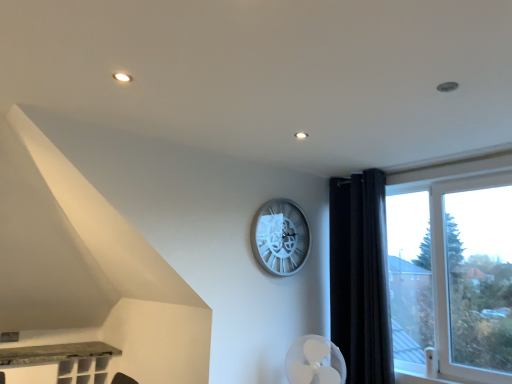
Question: From the image's perspective, would you say black velvet curtain at right is positioned over transparent glass window at right?

Choices:
 (A) no
 (B) yes

Answer: (A)

Question: From a real-world perspective, is black velvet curtain at right located beneath transparent glass window at right?

Choices:
 (A) yes
 (B) no

Answer: (A)

Question: Can you confirm if black velvet curtain at right is bigger than transparent glass window at right?

Choices:
 (A) no
 (B) yes

Answer: (B)

Question: Are black velvet curtain at right and transparent glass window at right located far from each other?

Choices:
 (A) no
 (B) yes

Answer: (A)

Question: Is black velvet curtain at right closer to camera compared to transparent glass window at right?

Choices:
 (A) no
 (B) yes

Answer: (A)

Question: Which is correct: black velvet curtain at right is inside transparent glass window at right, or outside of it?

Choices:
 (A) inside
 (B) outside

Answer: (B)

Question: In terms of width, does black velvet curtain at right look wider or thinner when compared to transparent glass window at right?

Choices:
 (A) thin
 (B) wide

Answer: (B)

Question: From the image's perspective, relative to transparent glass window at right, is black velvet curtain at right above or below?

Choices:
 (A) below
 (B) above

Answer: (A)

Question: From a real-world perspective, relative to transparent glass window at right, is black velvet curtain at right vertically above or below?

Choices:
 (A) below
 (B) above

Answer: (A)

Question: Considering the positions of silver metallic clock at center and black velvet curtain at right in the image, is silver metallic clock at center bigger or smaller than black velvet curtain at right?

Choices:
 (A) big
 (B) small

Answer: (B)

Question: From a real-world perspective, is silver metallic clock at center positioned above or below black velvet curtain at right?

Choices:
 (A) below
 (B) above

Answer: (B)

Question: Which is correct: silver metallic clock at center is inside black velvet curtain at right, or outside of it?

Choices:
 (A) inside
 (B) outside

Answer: (B)

Question: Is silver metallic clock at center wider or thinner than black velvet curtain at right?

Choices:
 (A) wide
 (B) thin

Answer: (B)

Question: From the image's perspective, is silver metallic clock at center above or below transparent glass window at right?

Choices:
 (A) above
 (B) below

Answer: (A)

Question: From a real-world perspective, is silver metallic clock at center physically located above or below transparent glass window at right?

Choices:
 (A) above
 (B) below

Answer: (A)